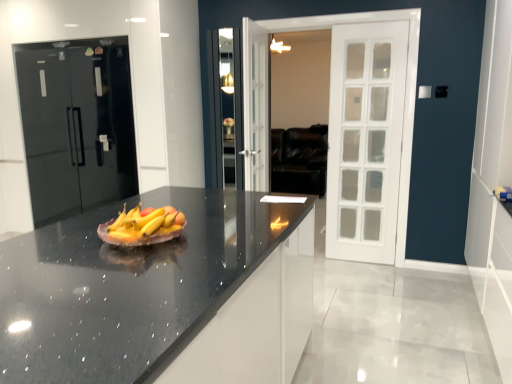
Question: Does black granite countertop at center turn towards matte ceramic grapefruit at center?

Choices:
 (A) no
 (B) yes

Answer: (A)

Question: Does black granite countertop at center have a greater height compared to matte ceramic grapefruit at center?

Choices:
 (A) no
 (B) yes

Answer: (B)

Question: Considering the relative sizes of black granite countertop at center and matte ceramic grapefruit at center in the image provided, is black granite countertop at center thinner than matte ceramic grapefruit at center?

Choices:
 (A) yes
 (B) no

Answer: (B)

Question: Considering the relative sizes of black granite countertop at center and matte ceramic grapefruit at center in the image provided, is black granite countertop at center shorter than matte ceramic grapefruit at center?

Choices:
 (A) no
 (B) yes

Answer: (A)

Question: Is black granite countertop at center wider than matte ceramic grapefruit at center?

Choices:
 (A) no
 (B) yes

Answer: (B)

Question: From the image's perspective, relative to matte ceramic grapefruit at center, is black granite countertop at center above or below?

Choices:
 (A) above
 (B) below

Answer: (B)

Question: Is point (82, 248) closer or farther from the camera than point (177, 228)?

Choices:
 (A) farther
 (B) closer

Answer: (B)

Question: In terms of height, does black granite countertop at center look taller or shorter compared to matte ceramic grapefruit at center?

Choices:
 (A) short
 (B) tall

Answer: (B)

Question: Would you say black granite countertop at center is to the left or to the right of matte ceramic grapefruit at center in the picture?

Choices:
 (A) left
 (B) right

Answer: (B)

Question: Considering the positions of point (101, 178) and point (481, 92), is point (101, 178) closer or farther from the camera than point (481, 92)?

Choices:
 (A) farther
 (B) closer

Answer: (A)

Question: From the image's perspective, relative to white door at right, is glossy black refrigerator at left above or below?

Choices:
 (A) above
 (B) below

Answer: (A)

Question: Considering the positions of glossy black refrigerator at left and white door at right in the image, is glossy black refrigerator at left bigger or smaller than white door at right?

Choices:
 (A) big
 (B) small

Answer: (A)

Question: From a real-world perspective, is glossy black refrigerator at left physically located above or below white door at right?

Choices:
 (A) below
 (B) above

Answer: (A)

Question: Is matte ceramic grapefruit at center in front of or behind black granite countertop at center in the image?

Choices:
 (A) behind
 (B) front

Answer: (A)

Question: From a real-world perspective, is matte ceramic grapefruit at center physically located above or below black granite countertop at center?

Choices:
 (A) below
 (B) above

Answer: (B)